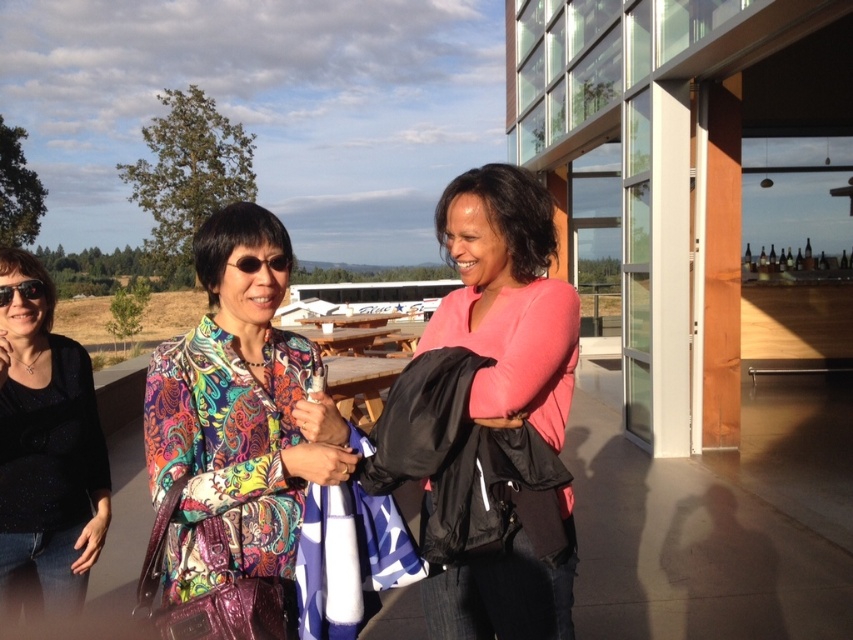
In the scene described, where is the sparkly black top at center located in terms of coordinates?

The sparkly black top at center is located at coordinates point [45,449].

You are a photographer trying to capture a clear shot of the sparkly black top at center and the matte black sunglasses at center. Which object is closer to the camera?

The sparkly black top at center is closer to the camera because the matte black sunglasses at center is behind it.

In the scene, there are two items of clothing or accessories visible. The multicolored silk blouse at center and the black plastic goggles at upper left. Which one is positioned to the right of the other?

The multicolored silk blouse at center is positioned to the right of the black plastic goggles at upper left.